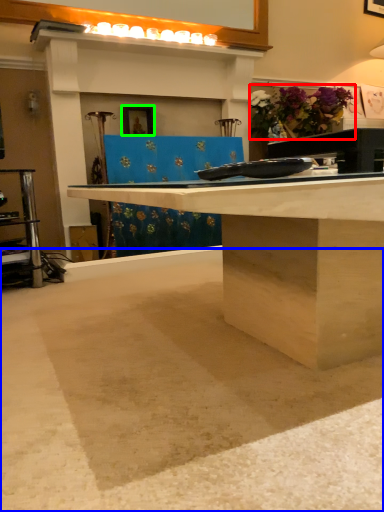
Question: Which object is positioned closest to flower (highlighted by a red box)? Select from concrete (highlighted by a blue box) and picture frame (highlighted by a green box).

Choices:
 (A) concrete
 (B) picture frame

Answer: (B)